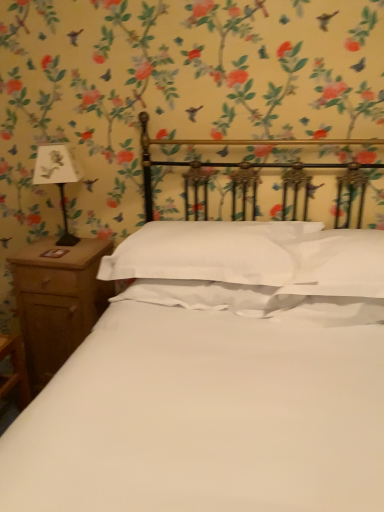
Where is `vacant space in front of white paper at left`? This screenshot has height=512, width=384. vacant space in front of white paper at left is located at coordinates (55, 258).